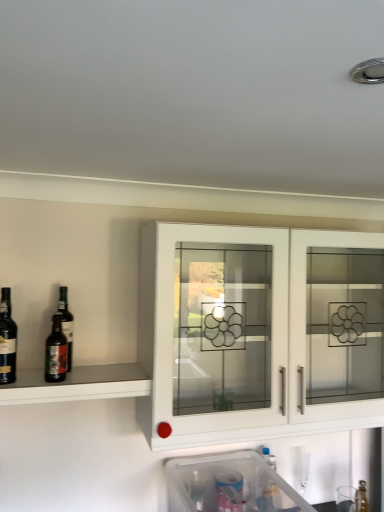
You are a GUI agent. You are given a task and a screenshot of the screen. Output one action in this format:
    pyautogui.click(x=<x>, y=<y>)
    Task: Click on the vacant area on top of matte glass shelf at left (from a real-world perspective)
    The width and height of the screenshot is (384, 512).
    Given the screenshot: What is the action you would take?
    (52, 380)